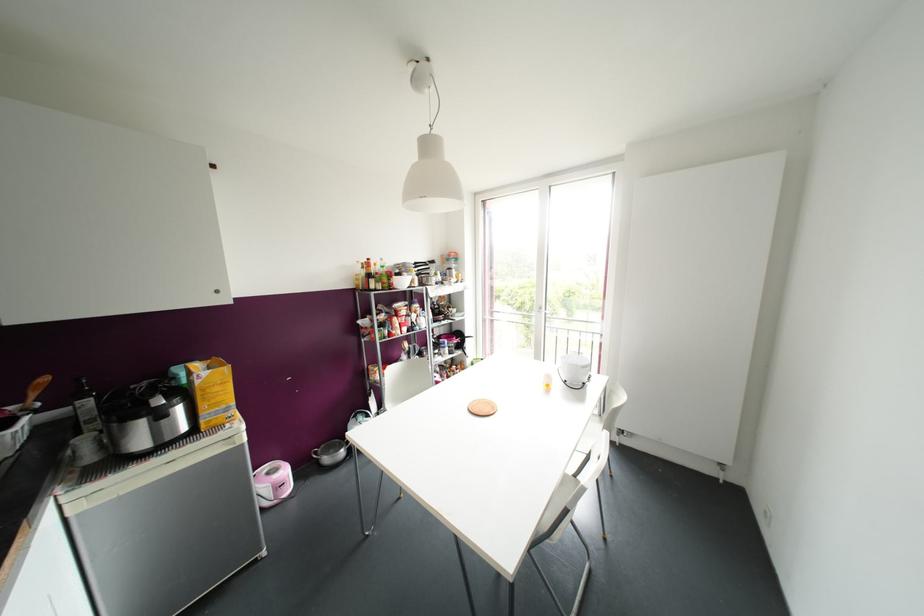
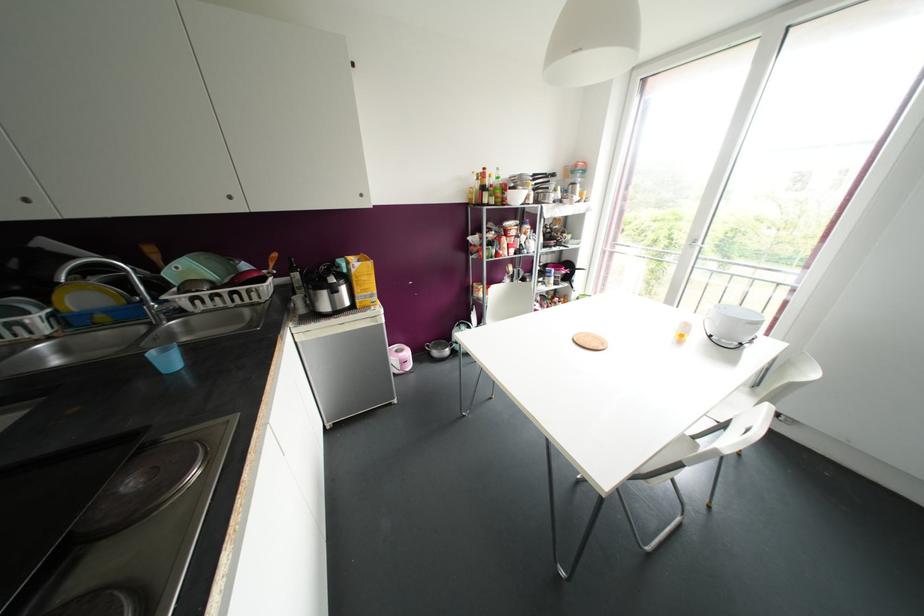
Locate, in the second image, the point that corresponds to [454,270] in the first image.

(578, 185)